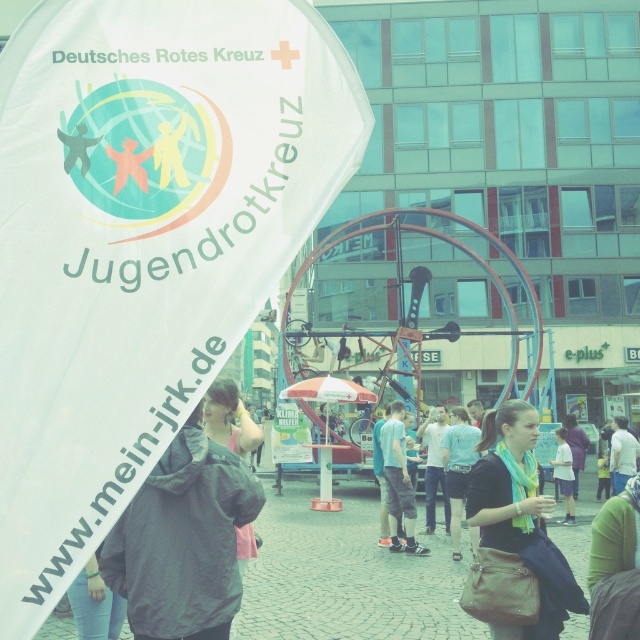
You are standing at the point with coordinates (516, 513) in the image. What object are you standing on?

The point with coordinates (516, 513) is on the teal scarf at center.

You are at an outdoor event and see the white fabric banner at upper left and the teal scarf at center. Which object is taller?

The white fabric banner at upper left is taller than the teal scarf at center.

What is located at the point with coordinates (x=141, y=241) in the image?

The white fabric banner at upper left is located at point (x=141, y=241).